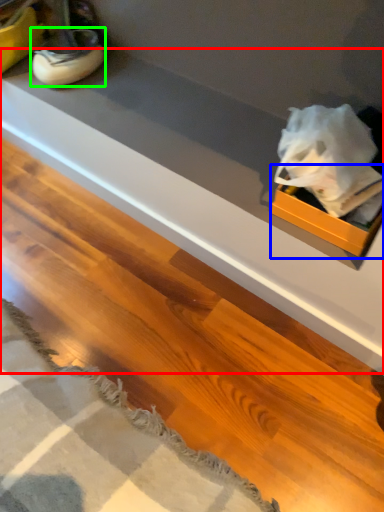
Question: Estimate the real-world distances between objects in this image. Which object is farther from counter top (highlighted by a red box), box (highlighted by a blue box) or footwear (highlighted by a green box)?

Choices:
 (A) box
 (B) footwear

Answer: (B)